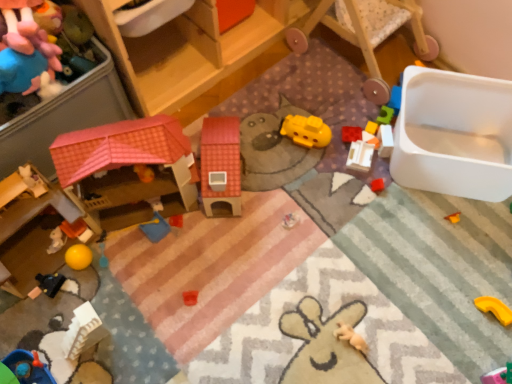
You are a GUI agent. You are given a task and a screenshot of the screen. Output one action in this format:
    pyautogui.click(x=<x>, y=<y>)
    Task: Click on the free area in between yellow matte submarine at center, which is the 5th toy in left-to-right order, and black matte toy car at lower left, the tenth toy viewed from the right
    This screenshot has width=512, height=384.
    Given the screenshot: What is the action you would take?
    pyautogui.click(x=198, y=205)